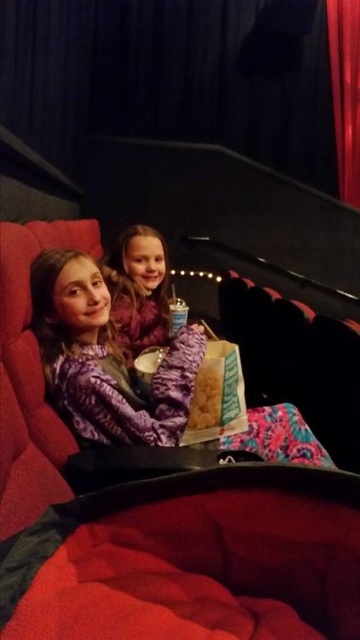
You are sitting in the movie theater and want to hand your drink to the girl wearing the purple patterned sweater at center without moving your seat. Can you do this if the velvet red curtain at right is blocking your path?

The purple patterned sweater at center is closer to the viewer than the velvet red curtain at right, so you can hand the drink to the girl wearing the purple patterned sweater at center without moving your seat because the curtain is behind her.

You are a theater employee checking the curtains for a performance. Which curtain is larger, the dark blue velvet curtain at upper center or the velvet red curtain at right?

The dark blue velvet curtain at upper center is bigger than the velvet red curtain at right.

You are sitting in a movie theater and want to see which curtain is closer to you. You see the dark blue velvet curtain at upper center and the velvet red curtain at right. Which one is closer to you?

The dark blue velvet curtain at upper center is closer to the viewer than the velvet red curtain at right.